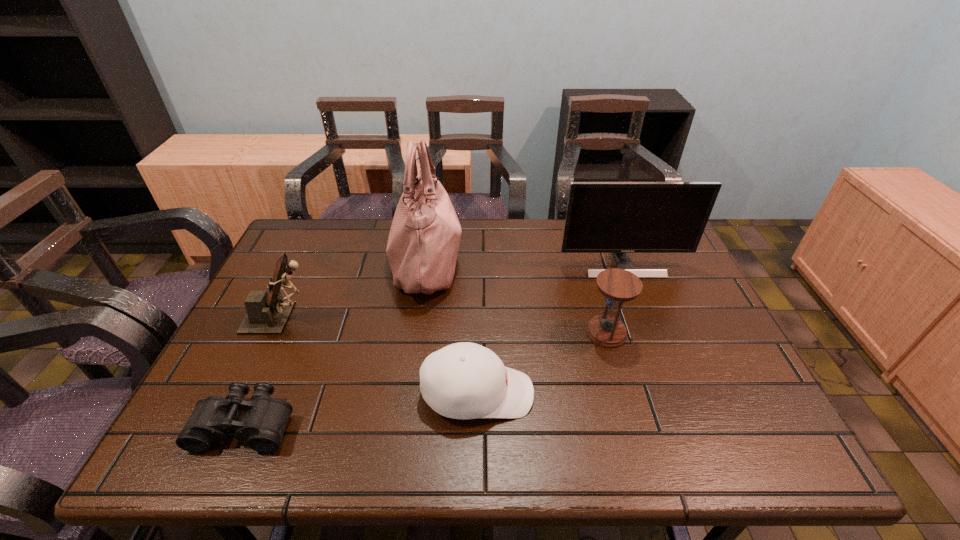
Where is `vacant space at the far edge`? This screenshot has height=540, width=960. vacant space at the far edge is located at coordinates (554, 232).

Where is `free spot at the left edge of the desktop`? The height and width of the screenshot is (540, 960). free spot at the left edge of the desktop is located at coordinates (212, 384).

Where is `free space at the right edge of the desktop`? The image size is (960, 540). free space at the right edge of the desktop is located at coordinates (729, 348).

Find the location of `free location at the far left corner of the desktop`. free location at the far left corner of the desktop is located at coordinates (312, 240).

Locate an element on the screen. The image size is (960, 540). free spot between the monitor and the tallest object is located at coordinates (524, 262).

Locate an element on the screen. unoccupied position between the baseball cap and the figurine is located at coordinates (379, 356).

What are the coordinates of `empty location between the tallest object and the second tallest object` in the screenshot? It's located at (524, 262).

This screenshot has height=540, width=960. Identify the location of free space between the baseball cap and the monitor. 550,329.

At what (x,y) coordinates should I click in order to perform the action: click on free space between the hourglass and the second shortest object. Please return your answer as a coordinate pair (x, y). Looking at the image, I should click on (541, 363).

Identify the location of empty space between the baseball cap and the handbag. (451, 327).